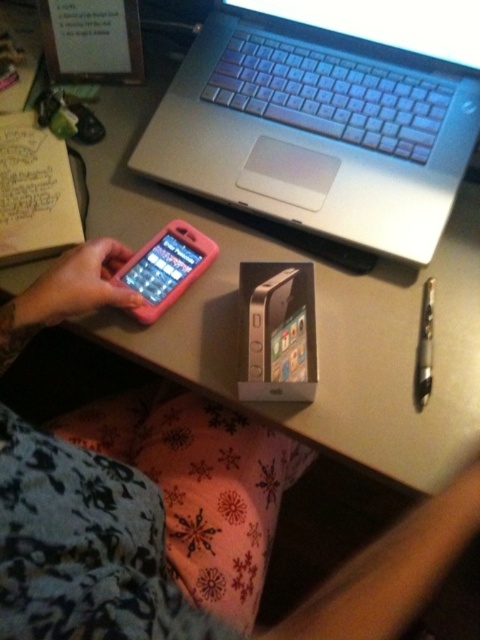
Question: Which object appears farthest from the camera in this image?

Choices:
 (A) silver metallic laptop at center
 (B) metallic pen at right
 (C) silver metallic ipod at center
 (D) pink matte smartphone at center

Answer: (D)

Question: Among these objects, which one is nearest to the camera?

Choices:
 (A) pink matte smartphone at center
 (B) pink matte phone at center
 (C) silver metallic ipod at center
 (D) silver metallic laptop at center

Answer: (B)

Question: Which point is farther to the camera?

Choices:
 (A) (386, 44)
 (B) (297, 401)
 (C) (143, 307)

Answer: (A)

Question: In this image, where is silver metallic ipod at center located relative to pink matte smartphone at center?

Choices:
 (A) left
 (B) right

Answer: (B)

Question: Can you confirm if pink matte phone at center is positioned to the left of metallic pen at right?

Choices:
 (A) yes
 (B) no

Answer: (A)

Question: Considering the relative positions of silver metallic ipod at center and pink matte smartphone at center in the image provided, where is silver metallic ipod at center located with respect to pink matte smartphone at center?

Choices:
 (A) right
 (B) left

Answer: (A)